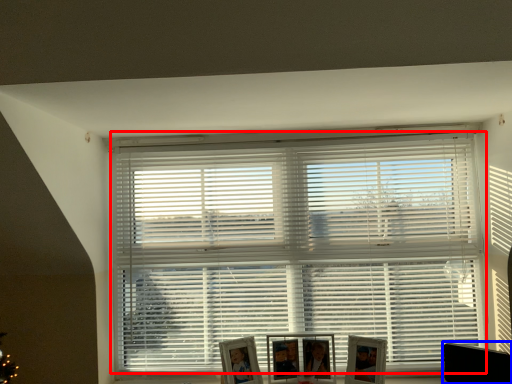
Question: Which object appears closest to the camera in this image, window blind (highlighted by a red box) or swivel chair (highlighted by a blue box)?

Choices:
 (A) window blind
 (B) swivel chair

Answer: (B)